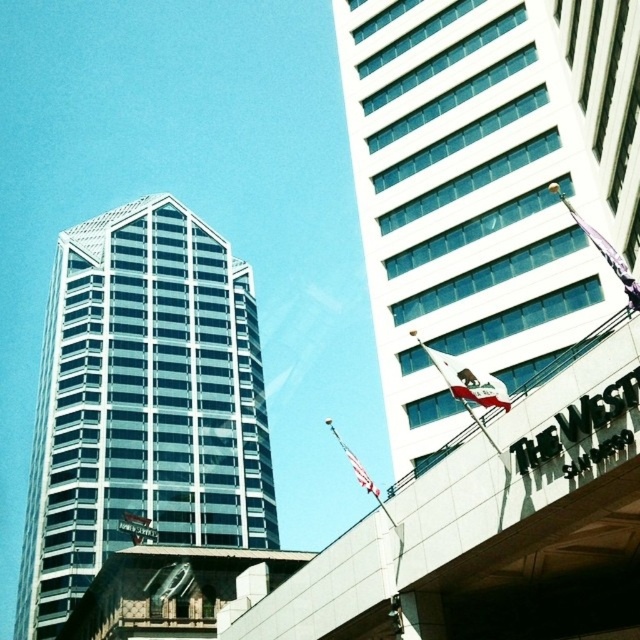
Question: In this image, where is white glass building at upper right located relative to glassy steel tower at left?

Choices:
 (A) left
 (B) right

Answer: (B)

Question: Can you confirm if white glass building at upper right is positioned below glassy steel tower at left?

Choices:
 (A) yes
 (B) no

Answer: (B)

Question: Is white glass building at upper right below glassy steel tower at left?

Choices:
 (A) yes
 (B) no

Answer: (B)

Question: Which object appears farthest from the camera in this image?

Choices:
 (A) glassy steel tower at left
 (B) white glass building at upper right

Answer: (A)